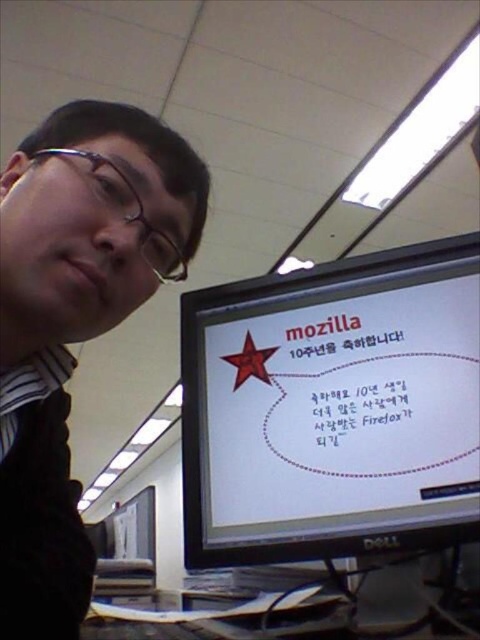
Question: Which of the following is the farthest from the observer?

Choices:
 (A) matte black glasses at upper left
 (B) white glossy monitor at center

Answer: (B)

Question: Is white glossy monitor at center below matte black glasses at upper left?

Choices:
 (A) no
 (B) yes

Answer: (B)

Question: Does white glossy monitor at center appear under matte black glasses at upper left?

Choices:
 (A) no
 (B) yes

Answer: (B)

Question: Which point appears farthest from the camera in this image?

Choices:
 (A) (6, 317)
 (B) (376, 467)

Answer: (B)

Question: Observing the image, what is the correct spatial positioning of white glossy monitor at center in reference to matte black glasses at upper left?

Choices:
 (A) left
 (B) right

Answer: (B)

Question: Which point appears farthest from the camera in this image?

Choices:
 (A) (67, 236)
 (B) (311, 499)

Answer: (B)